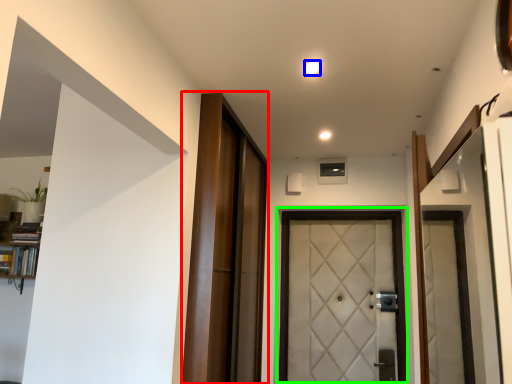
Question: Which is nearer to the barn door (highlighted by a red box)? light (highlighted by a blue box) or door (highlighted by a green box).

Choices:
 (A) light
 (B) door

Answer: (B)